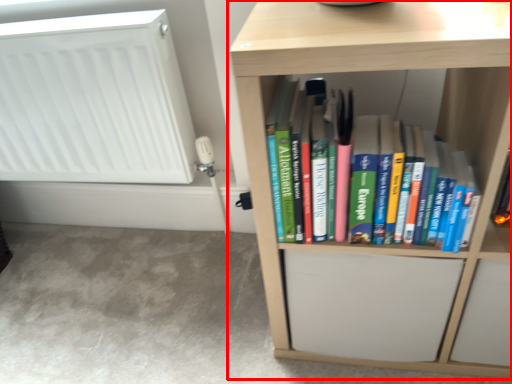
Question: From the image's perspective, where is shelf (annotated by the red box) located in relation to radiator in the image?

Choices:
 (A) above
 (B) below

Answer: (B)